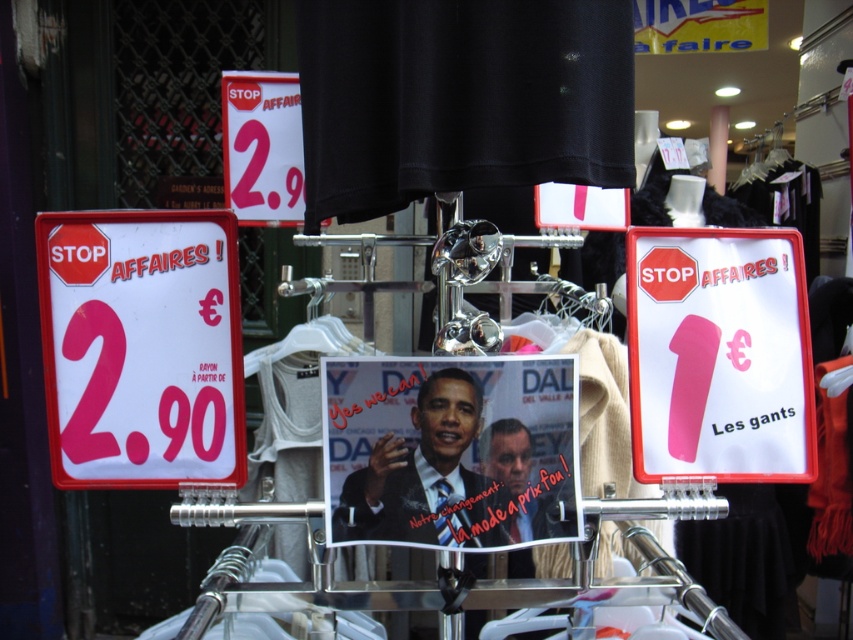
You are a store employee who needs to replace the white paper sign at left and the pink paper sign at center with new ones. If the new signs must be exactly the same width as the original ones, which sign requires a wider piece of paper?

The white paper sign at left requires a wider piece of paper because it might be wider than the pink paper sign at center according to the description.

You are a customer in the store and want to read both the white paper sign at left and the matte white sign at upper center. Which sign should you move to your left to read first?

The white paper sign at left is positioned on the left side of matte white sign at upper center, so you should move to your left to read the white paper sign at left first.

You are a store employee who needs to place a new 30 cm wide advertisement poster between the white paper sign at left and the matte white sign at upper center. Is there enough space between them to fit the poster without overlapping?

The distance between the white paper sign at left and the matte white sign at upper center is 59.62 centimeters, which is more than enough to fit a 30 cm wide poster without overlapping.